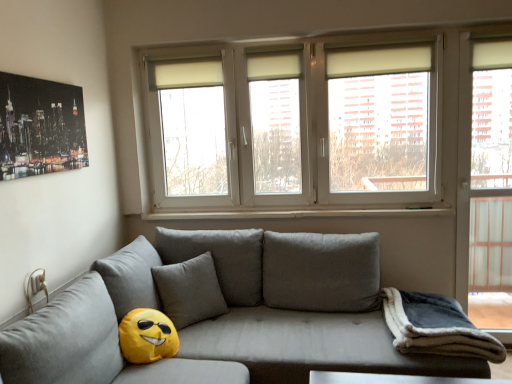
This screenshot has height=384, width=512. In order to click on free space above white plastic window sill at center (from a real-world perspective) in this screenshot , I will do `click(281, 208)`.